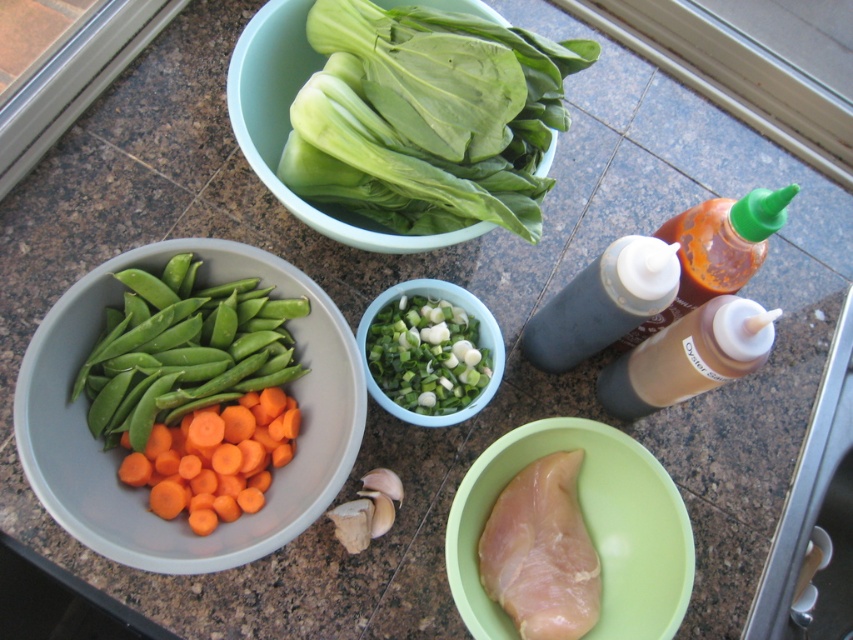
Is pale green plastic at center bigger than brown matte bottle at center-right?

Yes, pale green plastic at center is bigger than brown matte bottle at center-right.

Is pale green plastic at center shorter than brown matte bottle at center-right?

No, pale green plastic at center is not shorter than brown matte bottle at center-right.

The width and height of the screenshot is (853, 640). Describe the element at coordinates (585, 529) in the screenshot. I see `pale green plastic at center` at that location.

Find the location of a particular element. pale green plastic at center is located at coordinates (585, 529).

Does pale green plastic at center have a greater height compared to black matte bottle at center-right?

Yes, pale green plastic at center is taller than black matte bottle at center-right.

Who is positioned more to the left, pale green plastic at center or black matte bottle at center-right?

pale green plastic at center is more to the left.

Find the location of a particular element. pale green plastic at center is located at coordinates (585, 529).

Is orange matte carrot at left smaller than translucent plastic bottle at right?

Incorrect, orange matte carrot at left is not smaller in size than translucent plastic bottle at right.

Is point (84, 314) closer to camera compared to point (740, 266)?

That is True.

This screenshot has width=853, height=640. I want to click on orange matte carrot at left, so click(x=119, y=454).